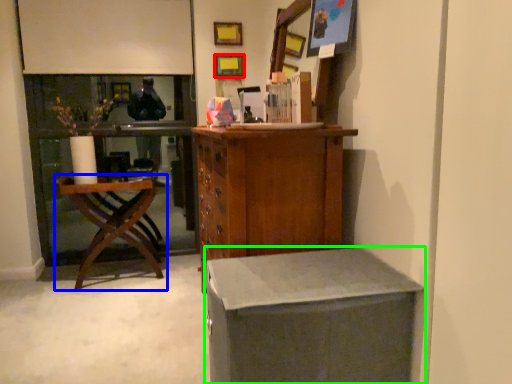
Question: Based on their relative distances, which object is nearer to picture frame (highlighted by a red box)? Choose from chair (highlighted by a blue box) and desk (highlighted by a green box).

Choices:
 (A) chair
 (B) desk

Answer: (A)